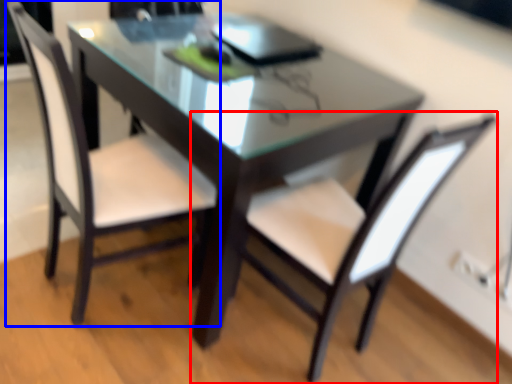
Question: Which of the following is the closest to the observer, chair (highlighted by a red box) or chair (highlighted by a blue box)?

Choices:
 (A) chair
 (B) chair

Answer: (A)